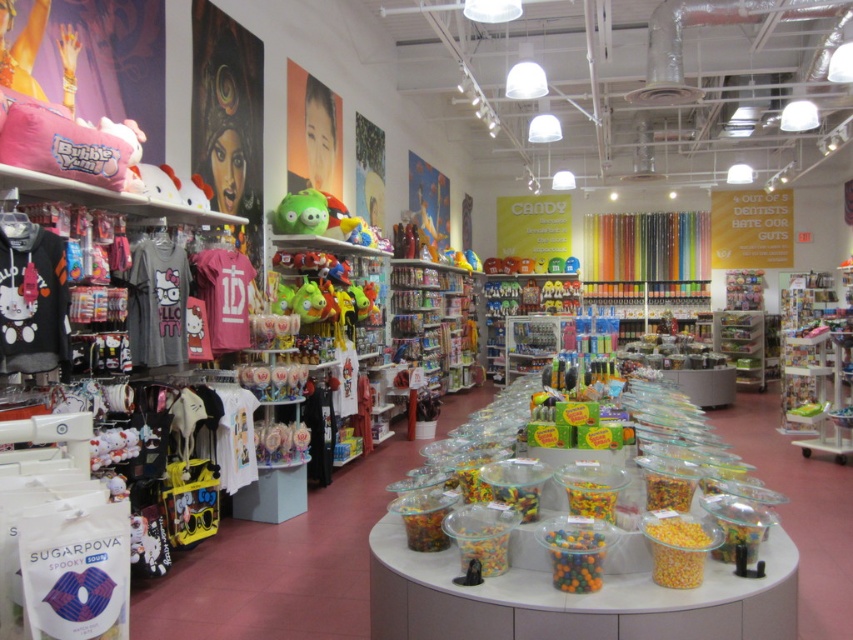
Question: Which of the following is the farthest from the observer?

Choices:
 (A) (311, 216)
 (B) (579, 566)

Answer: (A)

Question: Can you confirm if translucent plastic corn at center is bigger than green rubber toy at center?

Choices:
 (A) no
 (B) yes

Answer: (A)

Question: Can you confirm if translucent plastic corn at center is positioned above green rubber toy at center?

Choices:
 (A) no
 (B) yes

Answer: (A)

Question: Observing the image, what is the correct spatial positioning of translucent plastic corn at center in reference to translucent plastic container at center?

Choices:
 (A) below
 (B) above

Answer: (B)

Question: Estimate the real-world distances between objects in this image. Which object is closer to the green rubber toy at center?

Choices:
 (A) translucent plastic corn at center
 (B) translucent plastic container at center

Answer: (B)

Question: Considering the real-world distances, which object is farthest from the translucent plastic corn at center?

Choices:
 (A) green rubber toy at center
 (B) translucent plastic container at center

Answer: (A)